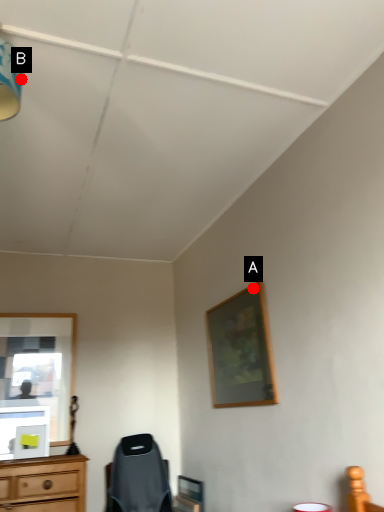
Question: Two points are circled on the image, labeled by A and B beside each circle. Among these points, which one is farthest from the camera?

Choices:
 (A) A is further
 (B) B is further

Answer: (A)